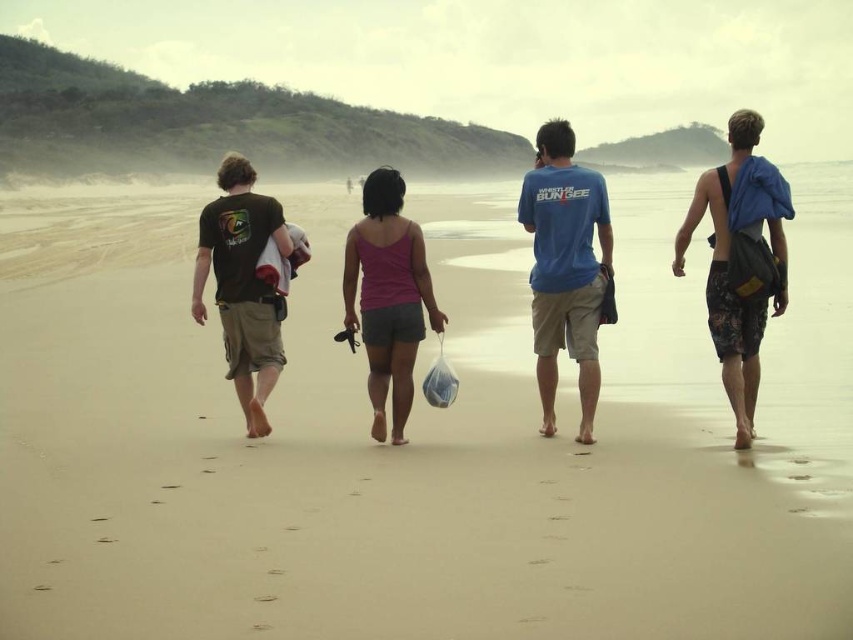
You are a GUI agent. You are given a task and a screenshot of the screen. Output one action in this format:
    pyautogui.click(x=<x>, y=<y>)
    Task: Click on the blue camouflage shorts at right
    
    Given the screenshot: What is the action you would take?
    pyautogui.click(x=740, y=260)

Does blue camouflage shorts at right appear over matte black t-shirt at left?

Correct, blue camouflage shorts at right is located above matte black t-shirt at left.

Which is in front, point (791, 205) or point (206, 257)?

Point (791, 205) is in front.

Image resolution: width=853 pixels, height=640 pixels. Find the location of `blue camouflage shorts at right`. blue camouflage shorts at right is located at coordinates (740, 260).

Does sandy beach at center have a smaller size compared to matte black t-shirt at left?

No.

Does point (323, 580) come in front of point (265, 232)?

That is True.

Where is `sandy beach at center`? This screenshot has height=640, width=853. sandy beach at center is located at coordinates click(x=413, y=436).

Between pink fabric tank top at center and matte black t-shirt at left, which one has less height?

pink fabric tank top at center

In order to click on pink fabric tank top at center in this screenshot , I will do `click(387, 296)`.

Identify the location of pink fabric tank top at center. Image resolution: width=853 pixels, height=640 pixels. (387, 296).